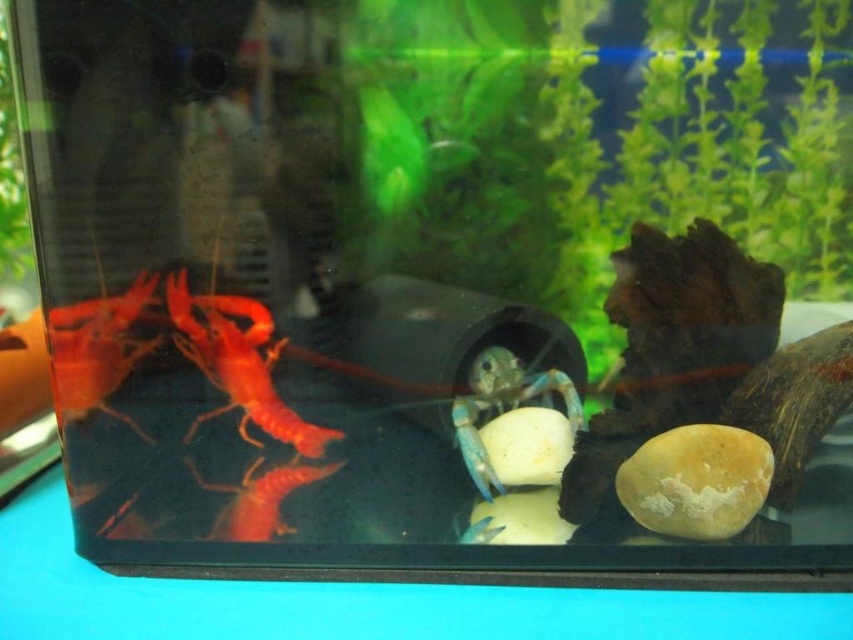
Question: Which of the following is the closest to the observer?

Choices:
 (A) (x=172, y=282)
 (B) (x=473, y=403)
 (C) (x=190, y=465)
 (D) (x=103, y=378)

Answer: (A)

Question: Can you confirm if blue translucent crab at center is positioned below translucent red shrimp at lower center?

Choices:
 (A) no
 (B) yes

Answer: (A)

Question: Is matte red shrimp at left below translucent red shrimp at lower center?

Choices:
 (A) no
 (B) yes

Answer: (A)

Question: Is matte red lobster at center bigger than blue translucent crab at center?

Choices:
 (A) no
 (B) yes

Answer: (B)

Question: Which point is farther to the camera?

Choices:
 (A) (202, 348)
 (B) (82, 308)
 (C) (479, 476)
 (D) (270, 504)

Answer: (C)

Question: Which object appears farthest from the camera in this image?

Choices:
 (A) blue translucent crab at center
 (B) matte red shrimp at left
 (C) matte red lobster at center
 (D) translucent red shrimp at lower center

Answer: (D)